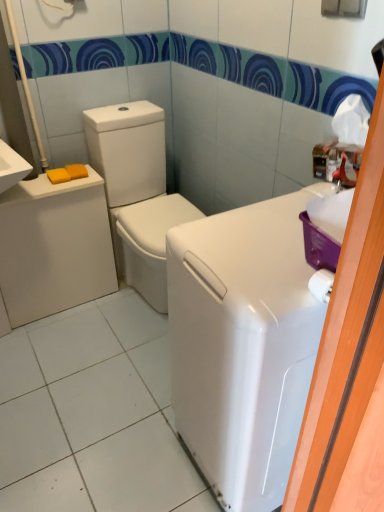
The height and width of the screenshot is (512, 384). In order to click on vacant area that is in front of yellow matte soap at left, which is counted as the 2th soap, starting from the left in this screenshot , I will do `click(64, 185)`.